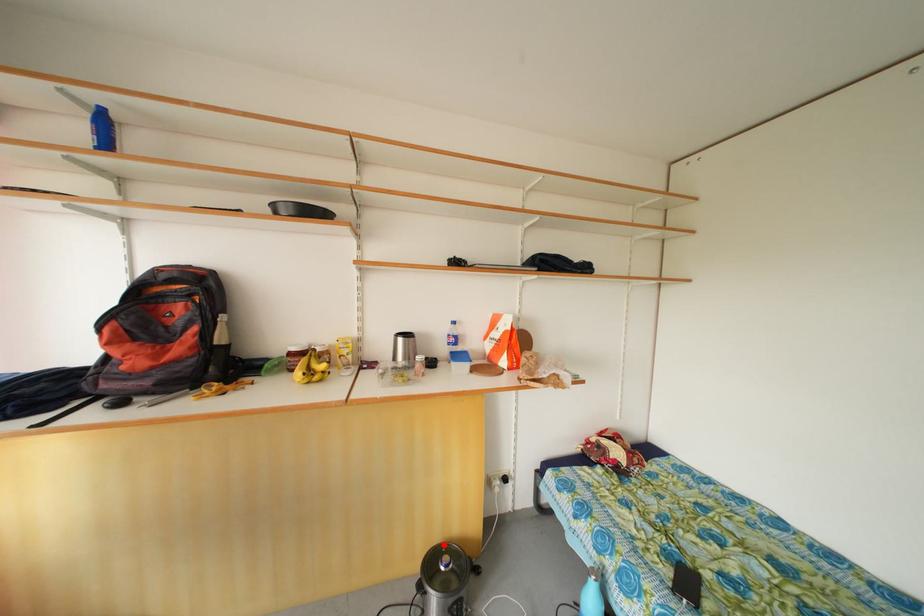
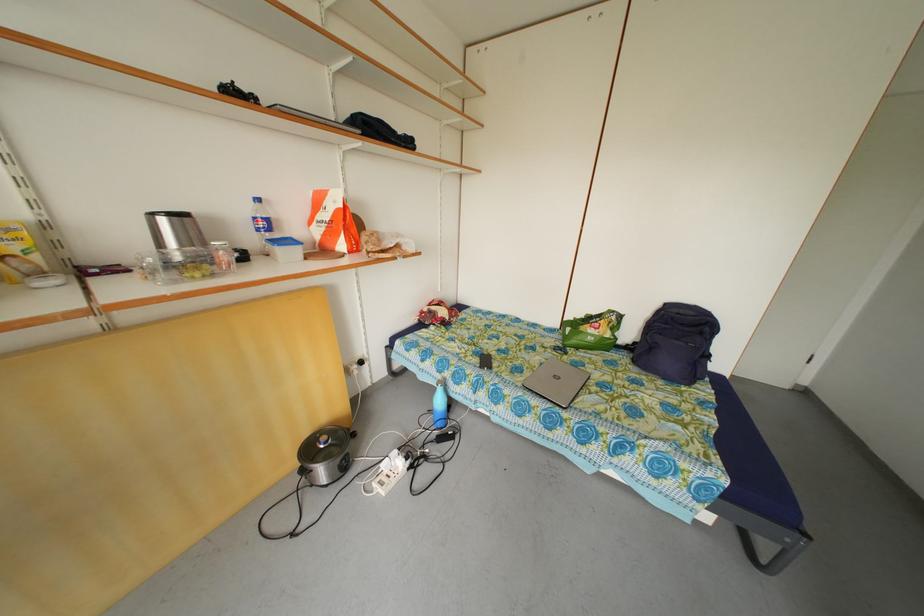
Question: I am providing you with two images of the same scene from different viewpoints. A red point is shown in image1. For the corresponding object point in image2, is it positioned nearer or farther from the camera?

Choices:
 (A) Nearer
 (B) Farther

Answer: (A)